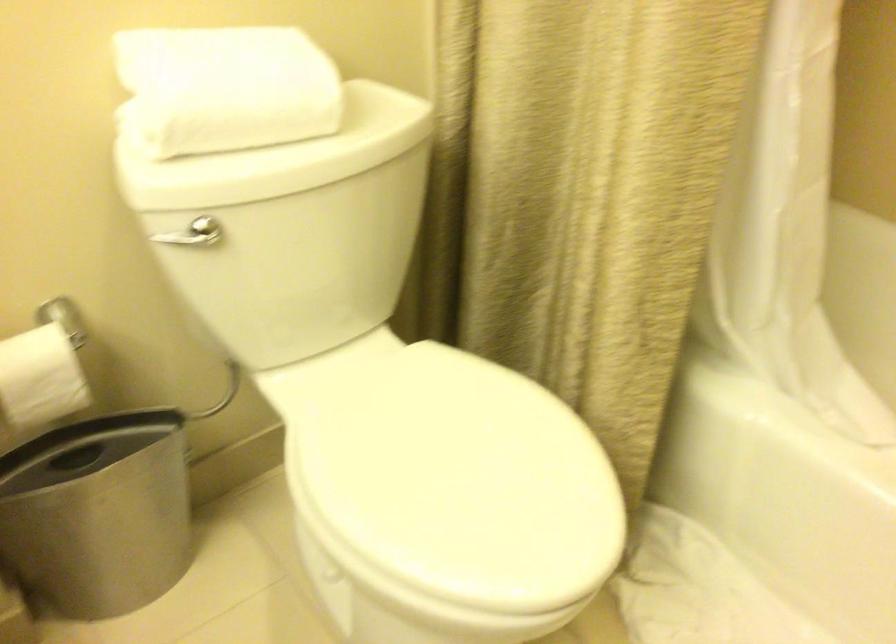
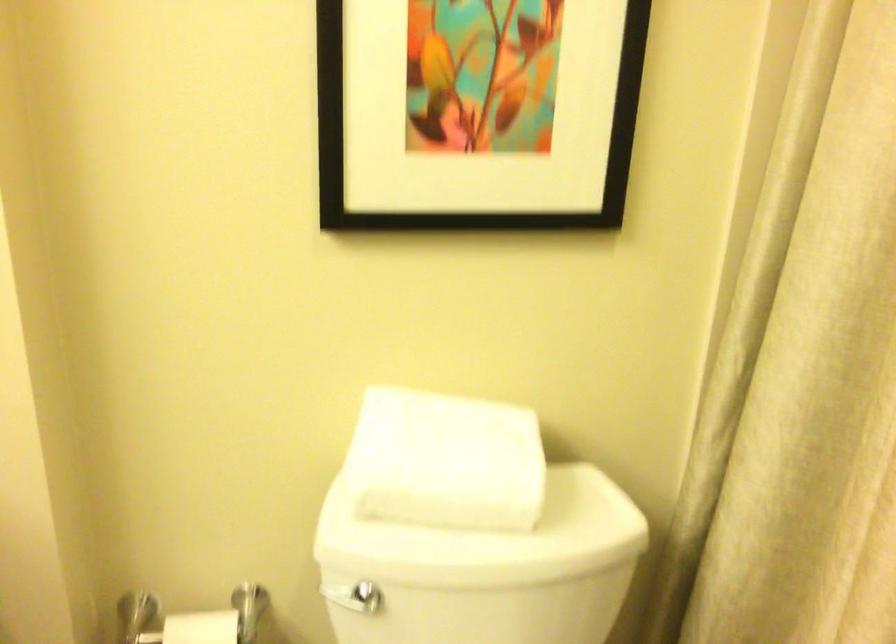
In the second image, find the point that corresponds to pixel 199 231 in the first image.

(359, 598)